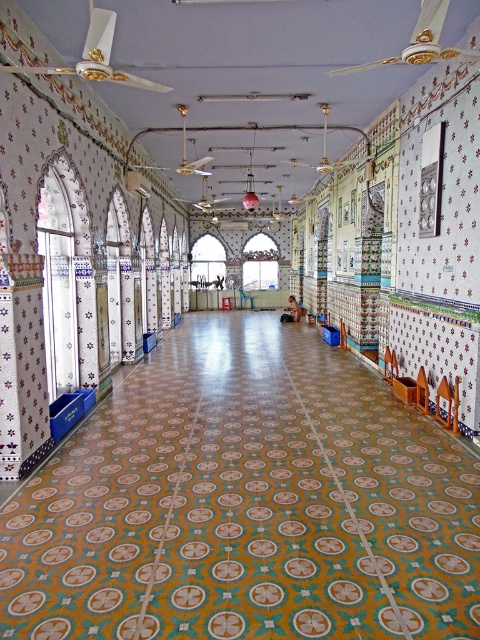
Which is behind, point (436, 406) or point (384, 364)?

Point (384, 364)

Identify the location of wooden chair at center. The height and width of the screenshot is (640, 480). (445, 401).

This screenshot has width=480, height=640. I want to click on wooden chair at center, so click(445, 401).

Does yellow plastic chair at center lie in front of light blue plastic chair at center?

That is True.

Who is more distant from viewer, (x=385, y=368) or (x=240, y=301)?

Point (x=240, y=301)

The height and width of the screenshot is (640, 480). Find the location of `yellow plastic chair at center`. yellow plastic chair at center is located at coordinates (389, 365).

Which is below, wooden chair at center or wooden chair at lower right?

wooden chair at center

Looking at this image, does wooden chair at center appear over wooden chair at lower right?

Incorrect, wooden chair at center is not positioned above wooden chair at lower right.

Locate an element on the screen. This screenshot has width=480, height=640. wooden chair at center is located at coordinates (445, 401).

The height and width of the screenshot is (640, 480). Find the location of `wooden chair at center`. wooden chair at center is located at coordinates (445, 401).